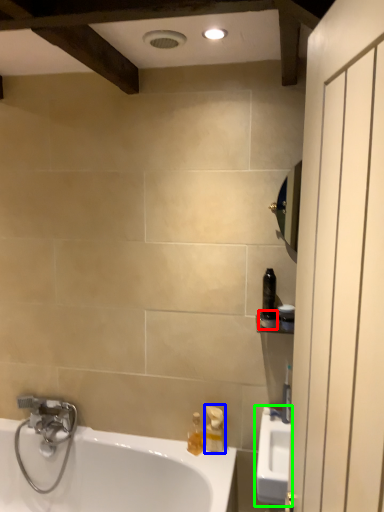
Question: Which is nearer to the toiletry (highlighted by a red box)? soap dispenser (highlighted by a blue box) or sink (highlighted by a green box).

Choices:
 (A) soap dispenser
 (B) sink

Answer: (B)